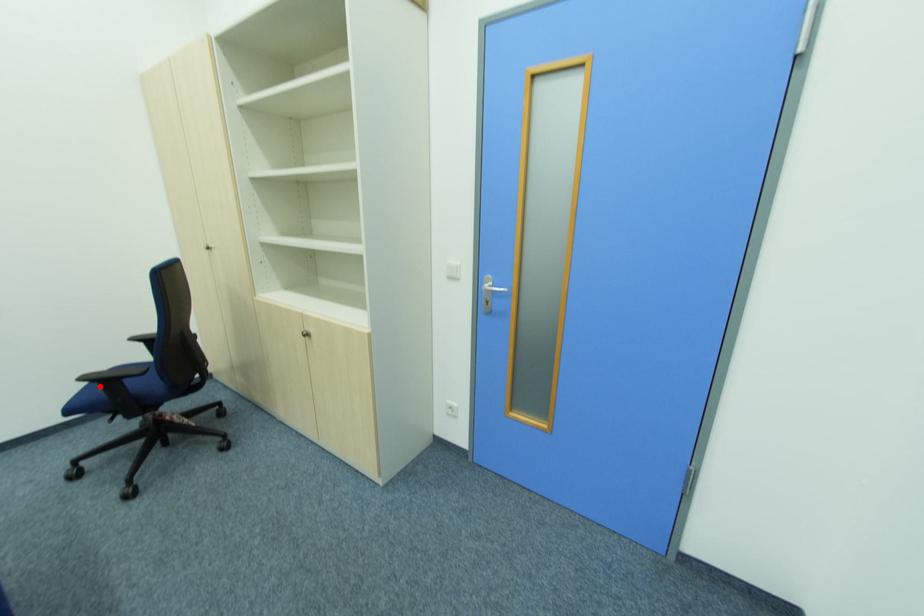
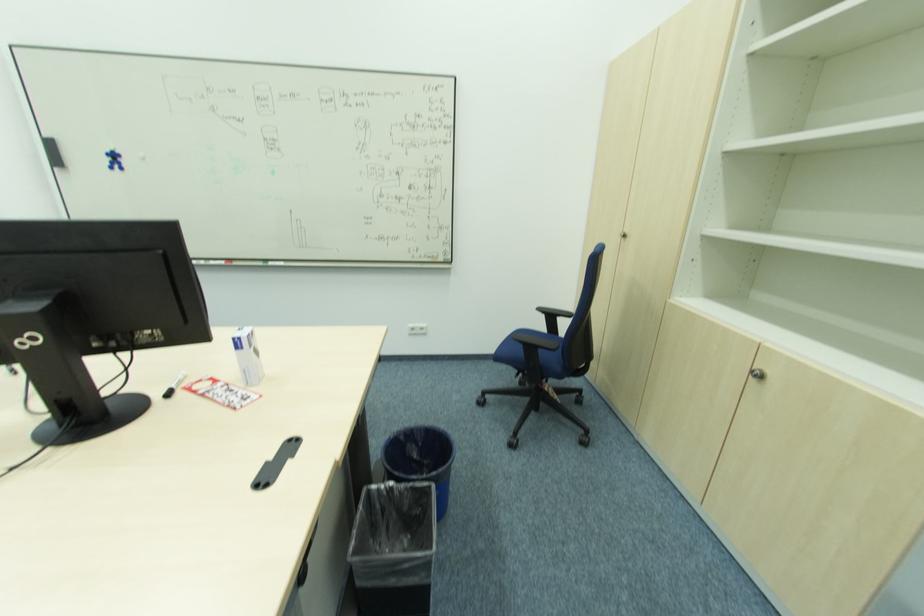
Find the pixel in the second image that matches the highlighted location in the first image.

(524, 347)